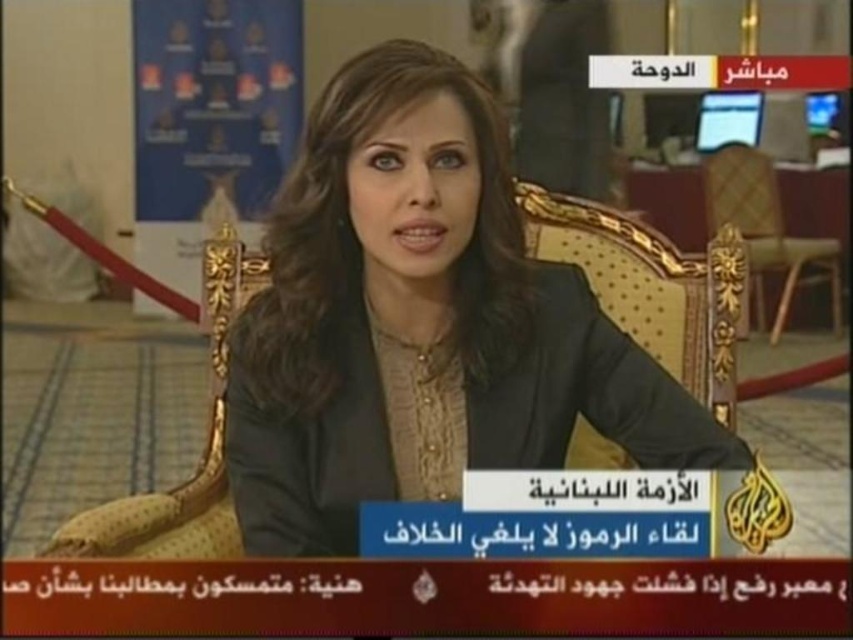
You are a costume designer preparing for a play and need to ensure the matte black suit at center fits over the wooden armchair at center for a scene. Based on the image, will the suit accommodate the chair?

The matte black suit at center has a larger width than the wooden armchair at center, so it should accommodate the chair.